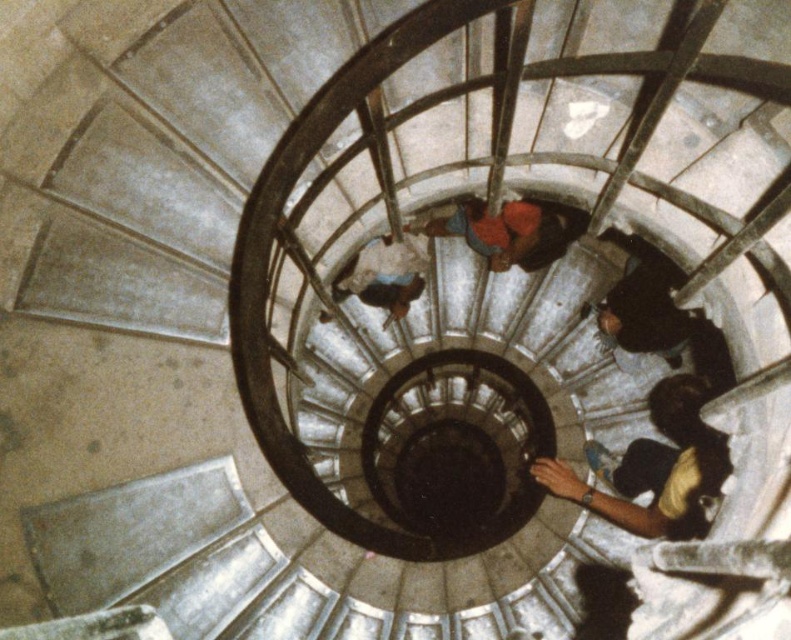
Question: Which point is closer to the camera?

Choices:
 (A) (405, 300)
 (B) (684, 502)
 (C) (498, 218)

Answer: (B)

Question: Which is farther from the blue fabric at center?

Choices:
 (A) red fabric jacket at center
 (B) dark blue jeans at bottom right

Answer: (B)

Question: Does red fabric jacket at center come behind blue fabric at center?

Choices:
 (A) yes
 (B) no

Answer: (B)

Question: Can you confirm if dark blue jeans at bottom right is positioned below red fabric jacket at center?

Choices:
 (A) yes
 (B) no

Answer: (A)

Question: Based on their relative distances, which object is nearer to the dark blue jeans at bottom right?

Choices:
 (A) red fabric jacket at center
 (B) blue fabric at center

Answer: (A)

Question: Considering the relative positions of dark blue jeans at bottom right and red fabric jacket at center in the image provided, where is dark blue jeans at bottom right located with respect to red fabric jacket at center?

Choices:
 (A) left
 (B) right

Answer: (B)